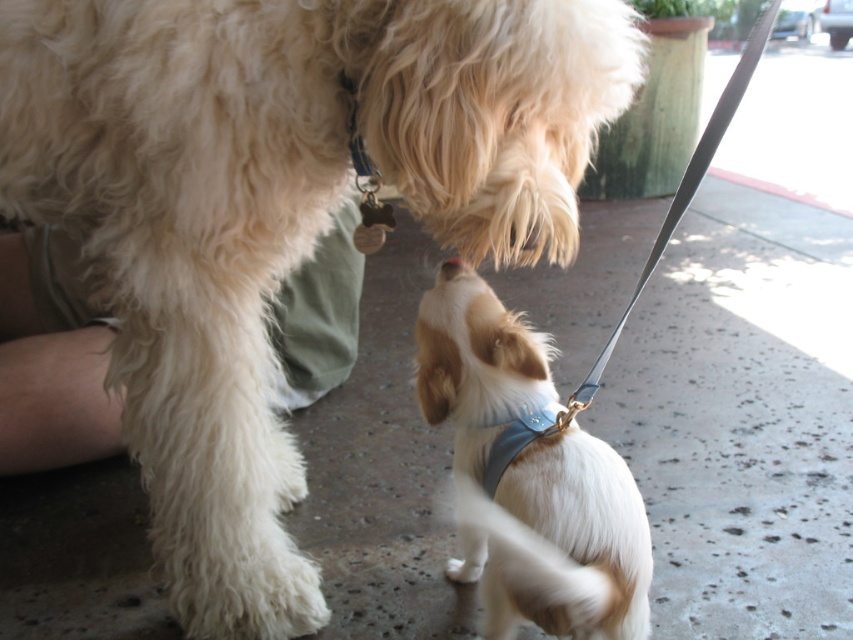
You are a dog owner who wants to attach a leash to your dog. You see the white soft fur dog at center and the blue fabric neckband at lower center. Which dog has the neckband?

The blue fabric neckband at lower center is located below the white soft fur dog at center, so the blue fabric neckband at lower center is attached to the smaller dog positioned below the white soft fur dog at center.

You are a photographer trying to capture a clear photo of the blue fabric neckband at lower center. However, the white soft fur dog at center is blocking your view. Can you move the dog to the side to get an unobstructed shot?

The white soft fur dog at center is in front of the blue fabric neckband at lower center, so moving the dog to the side would allow you to see the blue fabric neckband at lower center without obstruction.